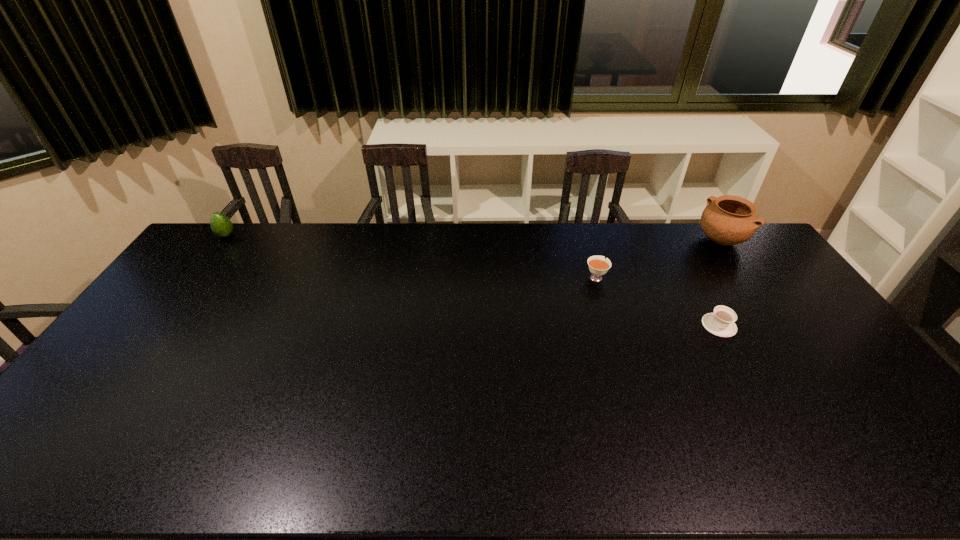
Locate an element on the screen. pottery is located at coordinates (727, 220).

What are the coordinates of `the tallest object` in the screenshot? It's located at (727, 220).

Image resolution: width=960 pixels, height=540 pixels. I want to click on avocado, so click(x=221, y=225).

The height and width of the screenshot is (540, 960). What are the coordinates of `the third shortest object` in the screenshot? It's located at (221, 225).

The height and width of the screenshot is (540, 960). Find the location of `the second nearest object`. the second nearest object is located at coordinates (598, 265).

Identify the location of the third object from right to left. (598, 265).

You are a GUI agent. You are given a task and a screenshot of the screen. Output one action in this format:
    pyautogui.click(x=<x>, y=<y>)
    Task: Click on the second object from right to left
    
    Given the screenshot: What is the action you would take?
    pyautogui.click(x=721, y=323)

At what (x,y) coordinates should I click in order to perform the action: click on the nearer teacup. Please return your answer as a coordinate pair (x, y). This screenshot has width=960, height=540. Looking at the image, I should click on (721, 323).

Locate an element on the screen. This screenshot has height=540, width=960. vacant point located on the left of the tallest object is located at coordinates (630, 240).

The height and width of the screenshot is (540, 960). What are the coordinates of `vacant position located on the front of the avocado` in the screenshot? It's located at (204, 266).